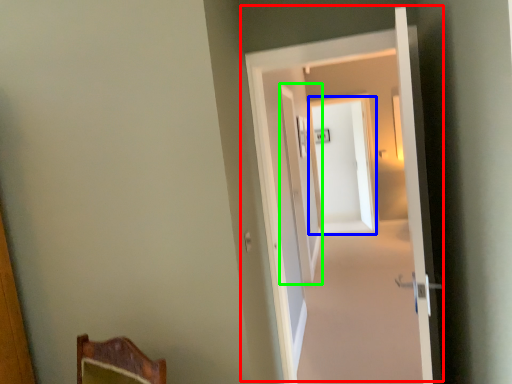
Question: Which object is the farthest from door (highlighted by a red box)? Choose among these: screen door (highlighted by a blue box) or screen door (highlighted by a green box).

Choices:
 (A) screen door
 (B) screen door

Answer: (A)